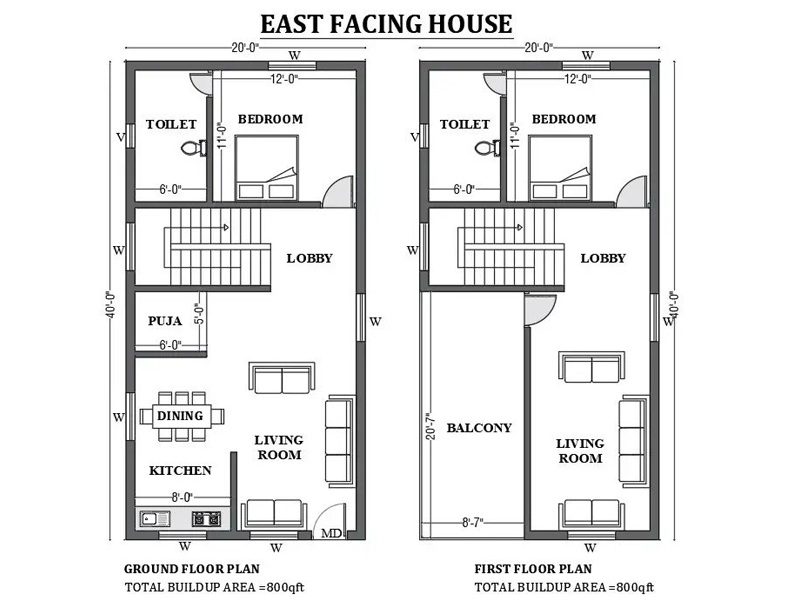
The width and height of the screenshot is (800, 600). Identify the location of couches. (266, 380), (342, 420), (278, 512), (601, 360), (626, 427), (586, 517).